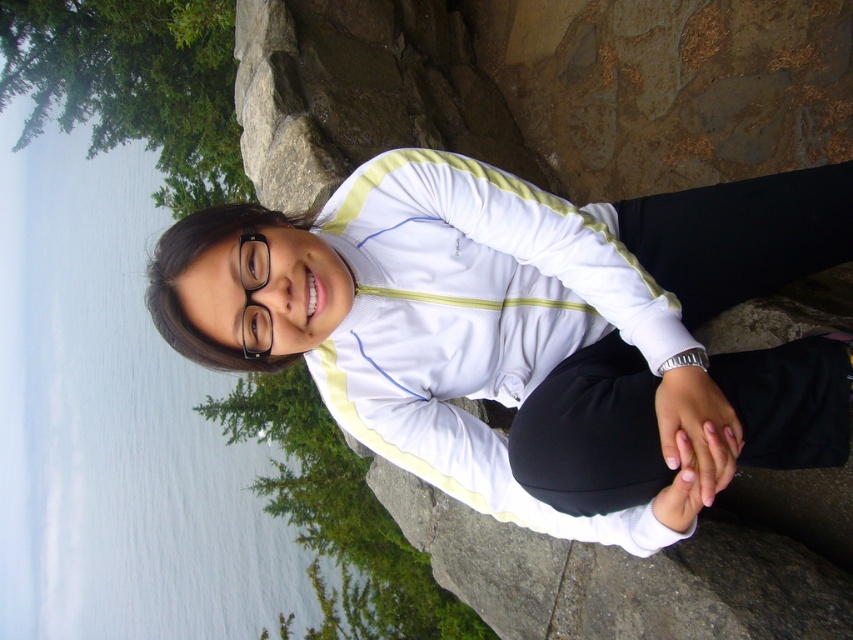
Question: Can you confirm if white smooth jacket at center is positioned below transparent plastic glasses at center?

Choices:
 (A) no
 (B) yes

Answer: (B)

Question: Which of the following is the farthest from the observer?

Choices:
 (A) transparent plastic glasses at center
 (B) silver metallic bracelet at lower center
 (C) white smooth jacket at center

Answer: (A)

Question: Is white smooth jacket at center bigger than transparent plastic glasses at center?

Choices:
 (A) no
 (B) yes

Answer: (B)

Question: Is white smooth jacket at center bigger than transparent plastic glasses at center?

Choices:
 (A) yes
 (B) no

Answer: (A)

Question: Which object is the closest to the silver metallic bracelet at lower center?

Choices:
 (A) transparent plastic glasses at center
 (B) white smooth jacket at center

Answer: (B)

Question: Which object is positioned farthest from the transparent plastic glasses at center?

Choices:
 (A) white smooth jacket at center
 (B) silver metallic bracelet at lower center

Answer: (B)